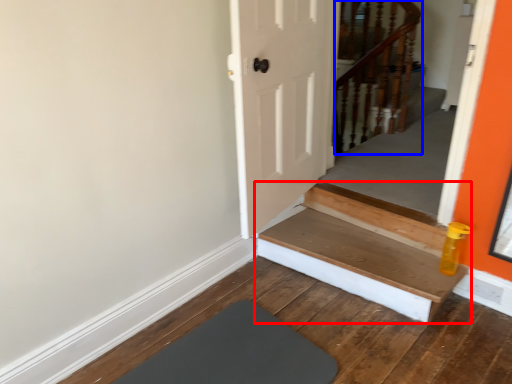
Question: Which point is further to the camera, stairs (highlighted by a red box) or rail (highlighted by a blue box)?

Choices:
 (A) stairs
 (B) rail

Answer: (B)